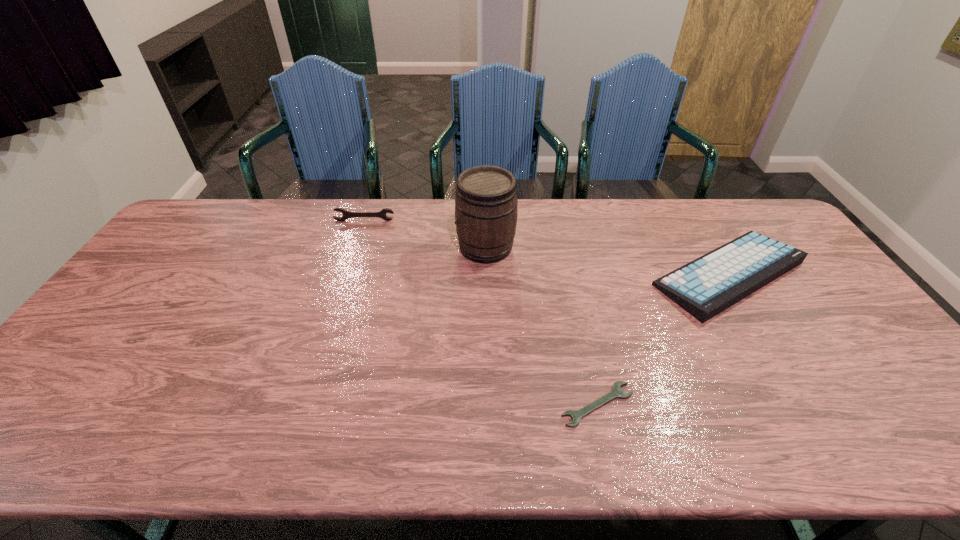
Find the location of a particular element. free area in between the farthest object and the third object from right to left is located at coordinates (x=425, y=234).

Locate an element on the screen. The width and height of the screenshot is (960, 540). unoccupied position between the farthest object and the shortest object is located at coordinates (481, 313).

Find the location of a particular element. This screenshot has width=960, height=540. object that can be found as the closest to the rightmost object is located at coordinates (576, 415).

Identify which object is the nearest to the shorter wrench. Please provide its 2D coordinates. Your answer should be formatted as a tuple, i.e. [(x, y)], where the tuple contains the x and y coordinates of a point satisfying the conditions above.

[(710, 284)]

You are a GUI agent. You are given a task and a screenshot of the screen. Output one action in this format:
    pyautogui.click(x=<x>, y=<y>)
    Task: Click on the free region that satisfies the following two spatial constraints: 1. on the open ends of the shorter wrench; 2. on the right side of the left wrench
    Image resolution: width=960 pixels, height=540 pixels.
    Given the screenshot: What is the action you would take?
    pyautogui.click(x=305, y=404)

Locate an element on the screen. Image resolution: width=960 pixels, height=540 pixels. vacant space that satisfies the following two spatial constraints: 1. on the open ends of the computer keyboard; 2. on the right side of the farther wrench is located at coordinates (348, 274).

Where is `free spot that satisfies the following two spatial constraints: 1. on the open ends of the farthest object; 2. on the left side of the computer keyboard`? The image size is (960, 540). free spot that satisfies the following two spatial constraints: 1. on the open ends of the farthest object; 2. on the left side of the computer keyboard is located at coordinates click(x=348, y=274).

This screenshot has height=540, width=960. I want to click on vacant region that satisfies the following two spatial constraints: 1. on the front side of the shorter wrench; 2. on the left side of the wine bucket, so click(x=489, y=404).

Find the location of a particular element. This screenshot has height=540, width=960. free space that satisfies the following two spatial constraints: 1. on the open ends of the computer keyboard; 2. on the left side of the taller wrench is located at coordinates (348, 274).

Identify the location of free region that satisfies the following two spatial constraints: 1. on the open ends of the tallest object; 2. on the left side of the farthest object. This screenshot has width=960, height=540. (356, 247).